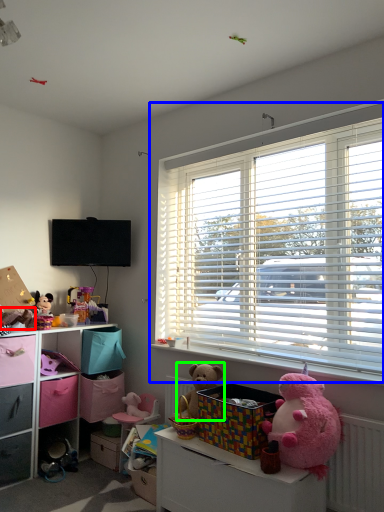
Question: Which object is positioned farthest from toy (highlighted by a red box)? Select from window (highlighted by a blue box) and teddy bear (highlighted by a green box).

Choices:
 (A) window
 (B) teddy bear

Answer: (A)